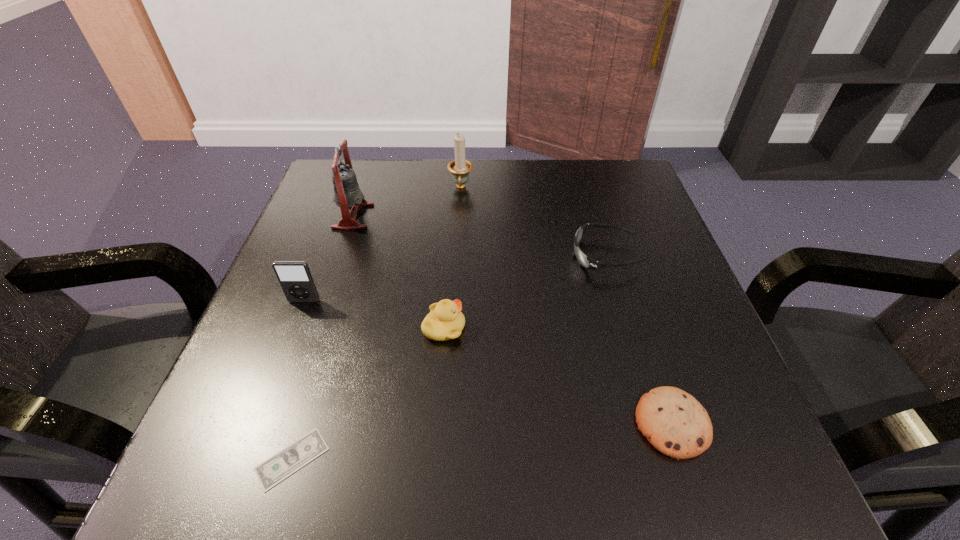
In order to click on free space at the near right corner of the desktop in this screenshot , I will do tap(717, 442).

Locate an element on the screen. The image size is (960, 540). empty space that is in between the fifth shortest object and the fifth nearest object is located at coordinates pyautogui.click(x=454, y=278).

Locate an element on the screen. This screenshot has height=540, width=960. vacant area that lies between the iPod and the fifth nearest object is located at coordinates tap(454, 278).

I want to click on vacant region between the duckling and the money, so coord(368,393).

Where is `free space between the third nearest object and the fourth farthest object`? The image size is (960, 540). free space between the third nearest object and the fourth farthest object is located at coordinates (374, 314).

Identify the location of vacant area between the money and the sunglasses. The image size is (960, 540). (448, 357).

Image resolution: width=960 pixels, height=540 pixels. I want to click on vacant space that's between the third nearest object and the farthest object, so click(452, 258).

Where is `free spot between the money and the third farthest object`? The height and width of the screenshot is (540, 960). free spot between the money and the third farthest object is located at coordinates (448, 357).

This screenshot has height=540, width=960. I want to click on free space between the sixth tallest object and the fifth farthest object, so click(558, 375).

Identify the location of vacant space in between the third tallest object and the second shortest object. The width and height of the screenshot is (960, 540). (488, 362).